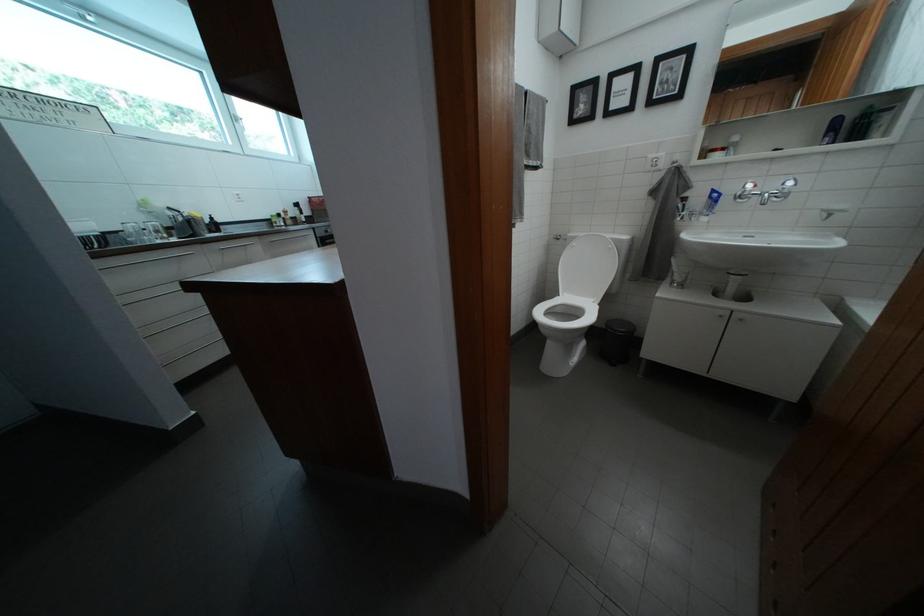
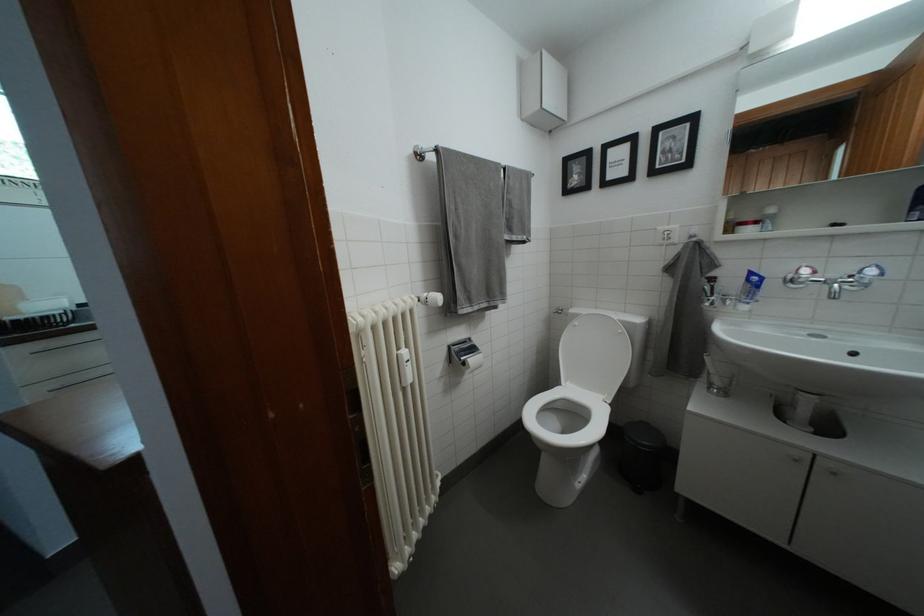
Which direction would the cameraman need to move to produce the second image?

The cameraman walked toward right, forward.